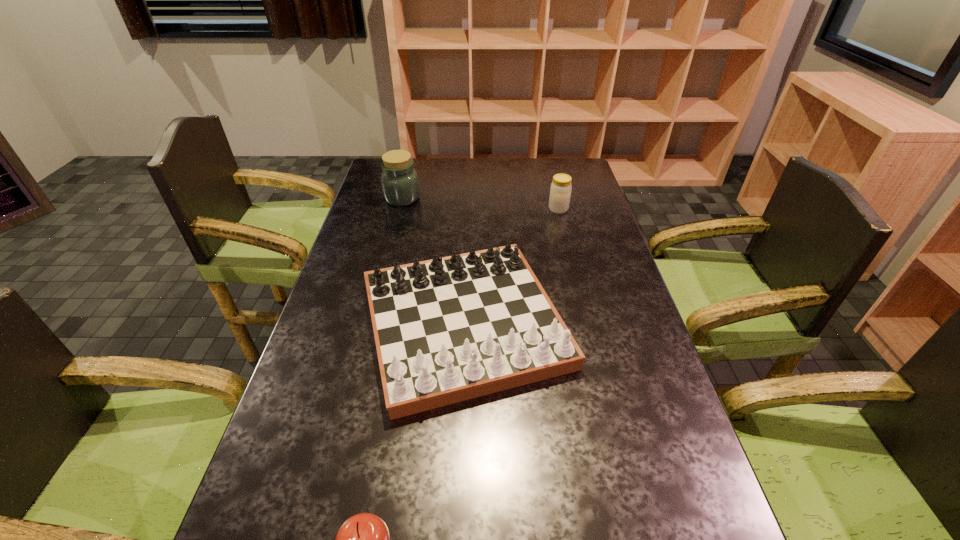
Where is `the taller jar`? the taller jar is located at coordinates (400, 184).

Identify the location of the left jar. This screenshot has width=960, height=540. (400, 184).

Where is `gameboard`? gameboard is located at coordinates (450, 329).

Locate an element on the screen. the right jar is located at coordinates (560, 192).

You are a GUI agent. You are given a task and a screenshot of the screen. Output one action in this format:
    pyautogui.click(x=<x>, y=<y>)
    Task: Click on the shorter jar
    
    Given the screenshot: What is the action you would take?
    pyautogui.click(x=560, y=192)

What are the coordinates of `free region located 0.250m on the front of the left jar` in the screenshot? It's located at (389, 250).

Image resolution: width=960 pixels, height=540 pixels. I want to click on free space located 0.220m on the back of the second nearest object, so 468,217.

Image resolution: width=960 pixels, height=540 pixels. Identify the location of blank space located 0.090m on the left of the rightmost object. (523, 209).

Locate an element on the screen. The width and height of the screenshot is (960, 540). jar at the left edge is located at coordinates (400, 184).

This screenshot has width=960, height=540. I want to click on gameboard present at the left edge, so click(450, 329).